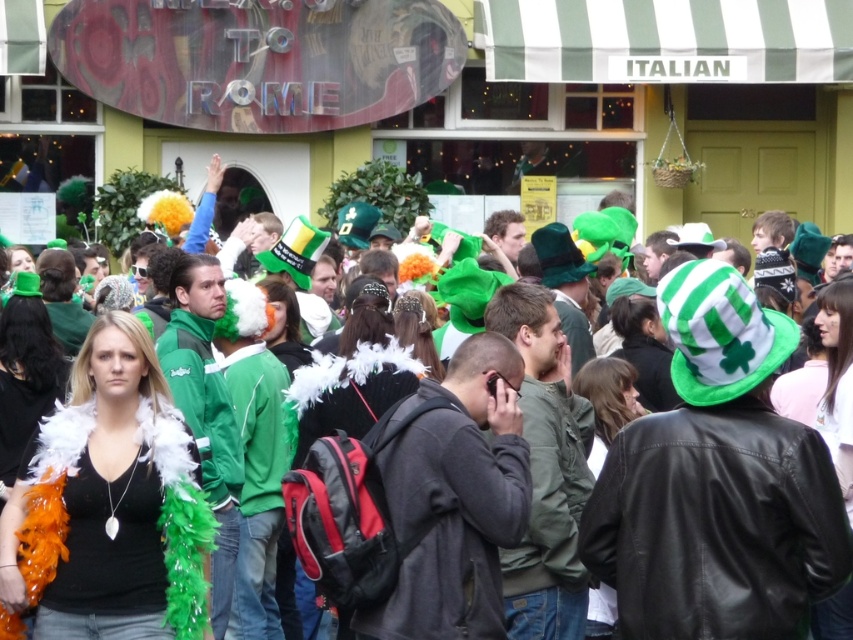
You are standing in the crowd outside the Italian building with the green and white striped awning. You notice two points marked in the scene. Which point, point 1 at coordinates (67, 566) or point 2 at (428, 352), is closer to you?

Point 1 at coordinates (67, 566) is closer to you than point 2 at (428, 352).

You are a photographer trying to capture the most vibrant part of the crowd. You notice a point at coordinates (352, 406). What object is located at this point?

The point at coordinates (352, 406) indicates the location of the feather boa at center.